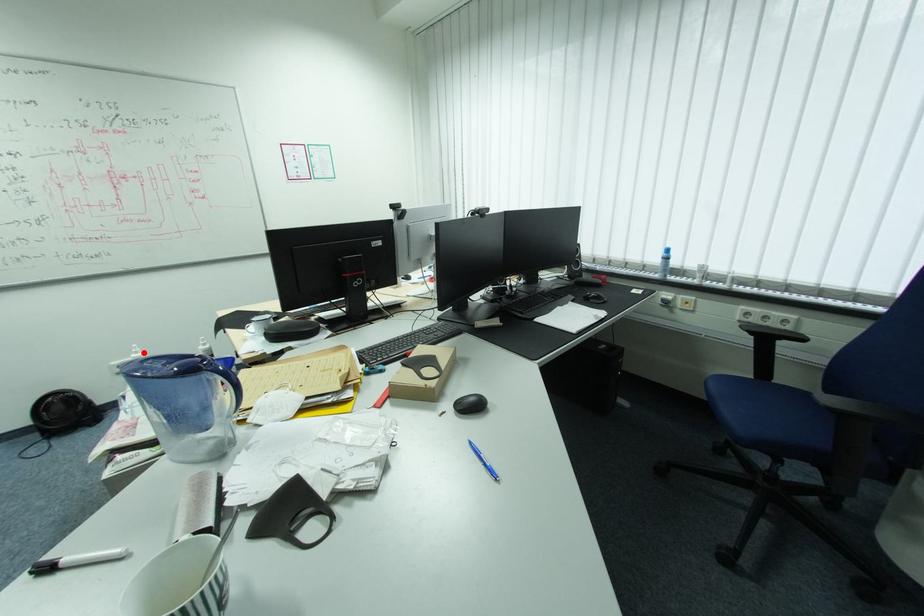
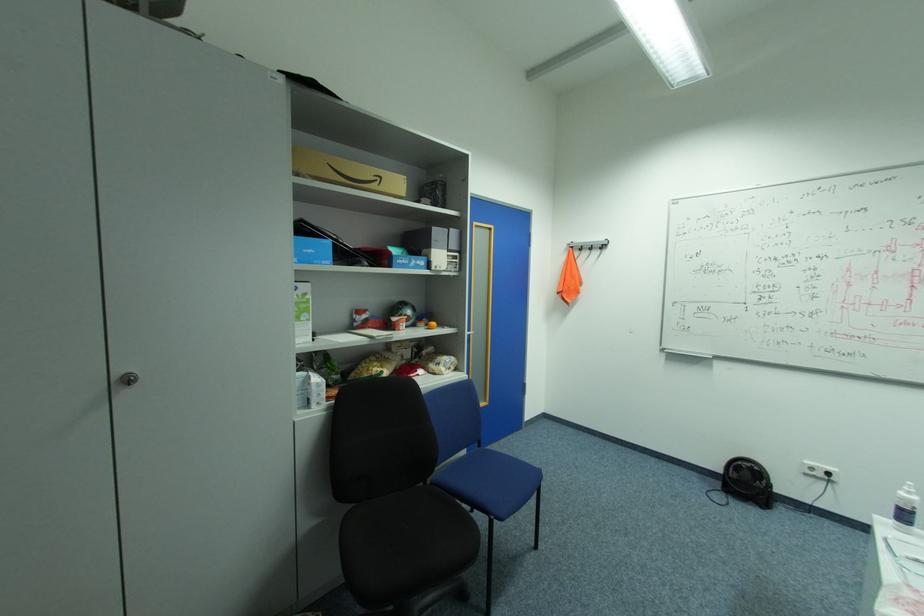
Question: I am providing you with two images of the same scene from different viewpoints. In image1, a red point is highlighted. Considering the same 3D point in image2, which of the following is correct?

Choices:
 (A) It is closer
 (B) It is farther

Answer: (B)